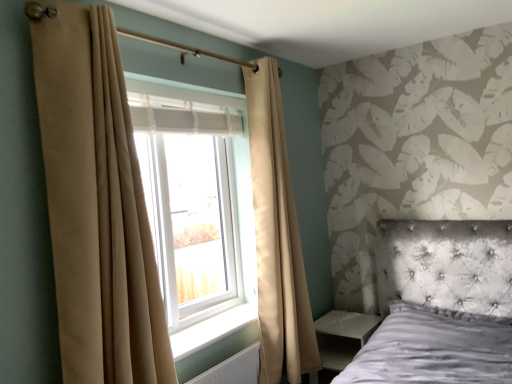
Question: From a real-world perspective, is beige fabric curtain at left, arranged as the 1th curtain when viewed from the front, above or below white glossy side table at lower right?

Choices:
 (A) above
 (B) below

Answer: (A)

Question: Would you say beige fabric curtain at left, the first curtain when ordered from left to right, is to the left or to the right of white glossy side table at lower right in the picture?

Choices:
 (A) right
 (B) left

Answer: (B)

Question: Estimate the real-world distances between objects in this image. Which object is farther from the white glossy side table at lower right?

Choices:
 (A) white smooth window sill at center
 (B) beige fabric curtain at left, arranged as the 1th curtain when viewed from the front
 (C) white textured radiator at lower center
 (D) white plastic window at center
 (E) beige fabric curtain at left, which is the first curtain from right to left

Answer: (B)

Question: Based on their relative distances, which object is farther from the white textured radiator at lower center?

Choices:
 (A) beige fabric curtain at left, acting as the 2th curtain starting from the right
 (B) white smooth window sill at center
 (C) white plastic window at center
 (D) white glossy side table at lower right
 (E) beige fabric curtain at left, which is the first curtain from right to left

Answer: (A)